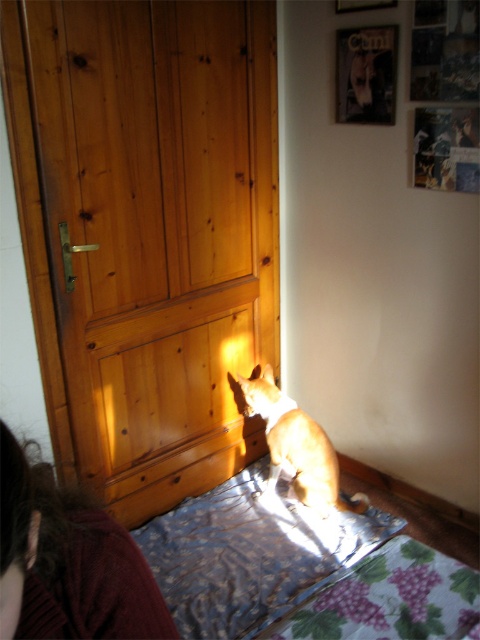
You are a cat looking for a place to nap. You see a metallic silver bed at center and a brown woolen sweater at lower left. Which object is closer to you?

The metallic silver bed at center is closer to you because it is further to the viewer than the brown woolen sweater at lower left, meaning it appears nearer in the scene.

You are a delivery person trying to place a small package on the metallic silver bed at center. The package is 1.2 meters wide. Can the package fit on the bed if the bed is wider than the brown fur cat at center?

The metallic silver bed at center is wider than the brown fur cat at center. However, without knowing the exact width of the bed, we cannot confirm if the 1.2 meter wide package will fit. More information is needed about the bed dimensions.